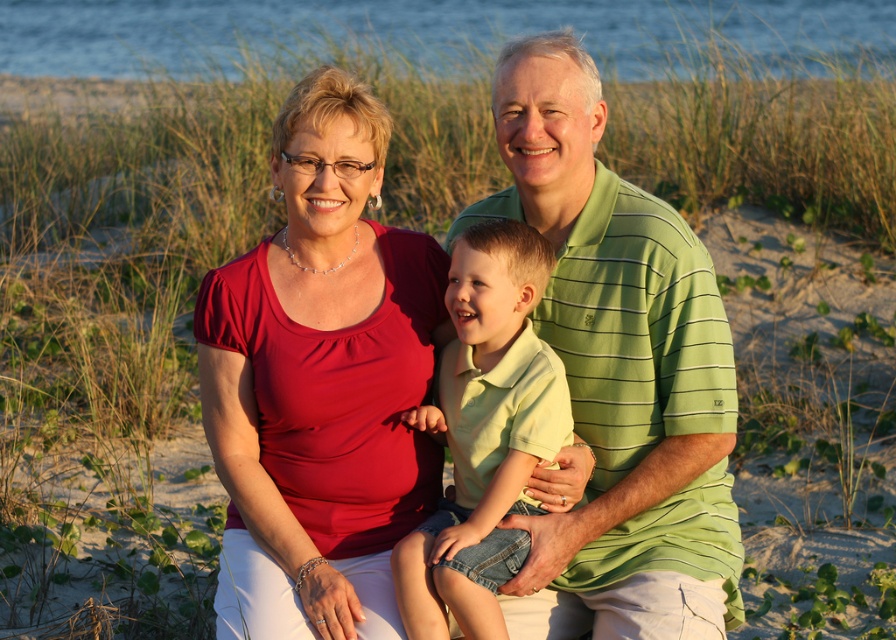
You are a photographer standing at the edge of the beach, and you want to take a group photo of the two adults wearing green shirts at center. The camera you are using has a minimum focus distance of 10 inches. Will you be able to focus on both adults wearing green striped polo shirt at center and green cotton shirt at center without moving closer?

The distance between the green striped polo shirt at center and green cotton shirt at center is 9.69 inches, which is less than the camera minimum focus distance of 10 inches. Therefore, the camera cannot focus on both adults simultaneously without moving closer.

You are a photographer trying to capture a candid shot of the two adults in the family. You notice both the green striped polo shirt at center and the green cotton shirt at center. Which adult should you focus on to ensure the subject is taller in the frame?

The green striped polo shirt at center is taller than the green cotton shirt at center, so focusing on the adult wearing the green striped polo shirt at center will ensure the subject appears taller in the frame.